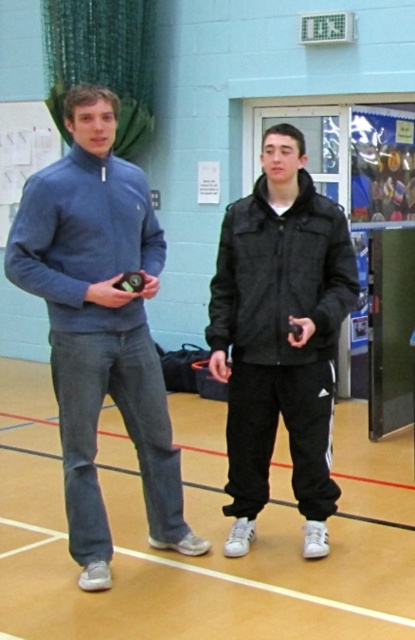
Question: Can you confirm if blue fleece sweater at left is thinner than black matte jacket at center?

Choices:
 (A) no
 (B) yes

Answer: (A)

Question: Which of the following is the closest to the observer?

Choices:
 (A) black matte jacket at center
 (B) blue fleece sweater at left

Answer: (B)

Question: Is blue fleece sweater at left thinner than black matte jacket at center?

Choices:
 (A) yes
 (B) no

Answer: (B)

Question: Is blue fleece sweater at left closer to camera compared to black matte jacket at center?

Choices:
 (A) yes
 (B) no

Answer: (A)

Question: Among these points, which one is farthest from the camera?

Choices:
 (A) (317, 385)
 (B) (109, 374)

Answer: (A)

Question: Which point is closer to the camera?

Choices:
 (A) (144, 417)
 (B) (302, 429)

Answer: (A)